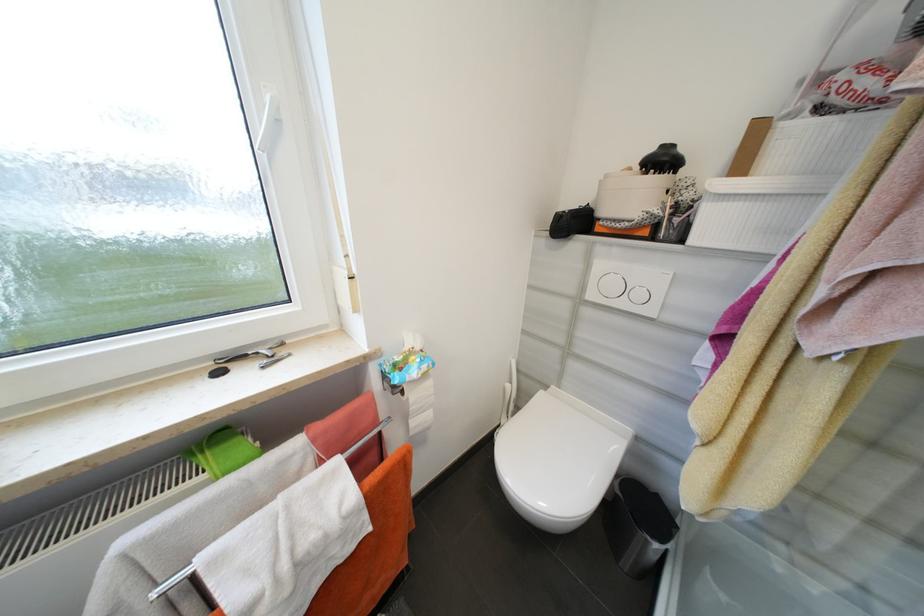
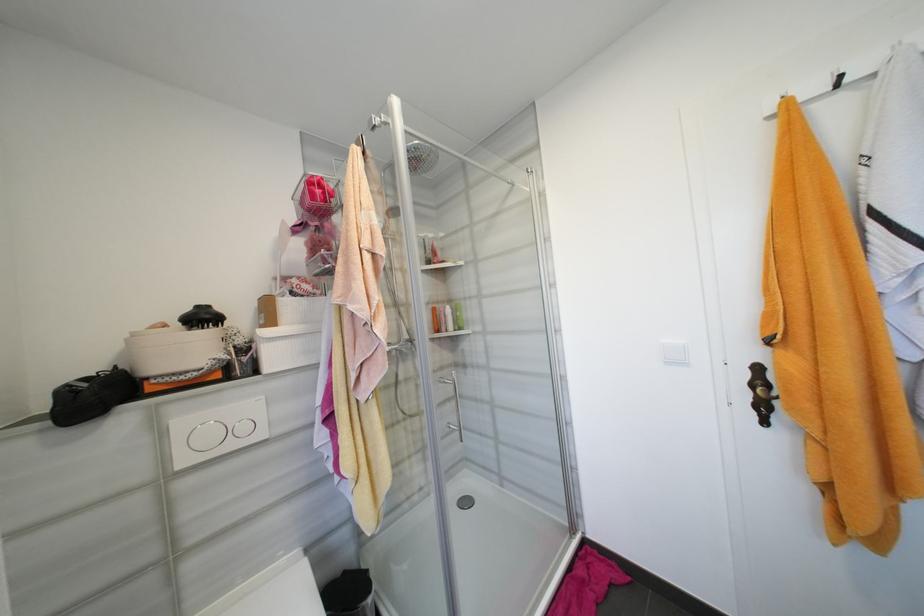
Question: The camera is either moving clockwise (left) or counter-clockwise (right) around the object. The first image is from the beginning of the video and the second image is from the end. Is the camera moving left or right when shooting the video?

Choices:
 (A) Left
 (B) Right

Answer: (A)